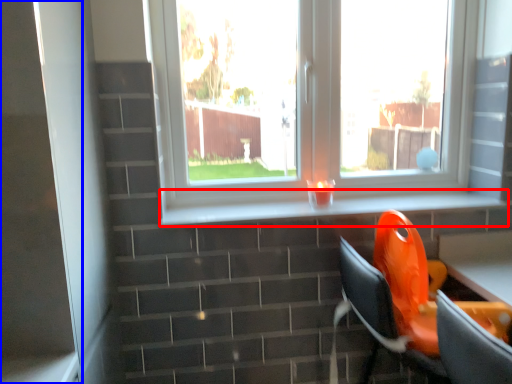
Question: Which object appears farthest to the camera in this image, window sill (highlighted by a red box) or screen door (highlighted by a blue box)?

Choices:
 (A) window sill
 (B) screen door

Answer: (A)